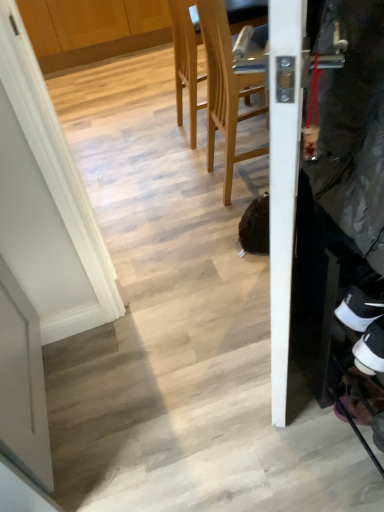
Question: Does white suede sneaker at lower right appear on the right side of wooden at center, acting as the first chair starting from the front?

Choices:
 (A) yes
 (B) no

Answer: (A)

Question: From the image's perspective, is white suede sneaker at lower right under wooden at center, acting as the first chair starting from the front?

Choices:
 (A) no
 (B) yes

Answer: (B)

Question: Considering the relative positions of white suede sneaker at lower right and wooden at center, acting as the first chair starting from the front, in the image provided, is white suede sneaker at lower right in front of wooden at center, acting as the first chair starting from the front,?

Choices:
 (A) yes
 (B) no

Answer: (A)

Question: Does white suede sneaker at lower right contain wooden at center, acting as the first chair starting from the front?

Choices:
 (A) yes
 (B) no

Answer: (B)

Question: Does white suede sneaker at lower right have a lesser width compared to wooden at center, acting as the first chair starting from the front?

Choices:
 (A) yes
 (B) no

Answer: (A)

Question: Does point (183, 16) appear closer or farther from the camera than point (259, 79)?

Choices:
 (A) closer
 (B) farther

Answer: (B)

Question: From the image's perspective, is light wood chair at upper center, which is the second chair from front to back, above or below wooden at center, the 2th chair when ordered from back to front?

Choices:
 (A) below
 (B) above

Answer: (B)

Question: Based on their positions, is light wood chair at upper center, which is the second chair from front to back, located to the left or right of wooden at center, acting as the first chair starting from the front?

Choices:
 (A) right
 (B) left

Answer: (B)

Question: In terms of size, does light wood chair at upper center, which is the second chair from front to back, appear bigger or smaller than wooden at center, the 2th chair when ordered from back to front?

Choices:
 (A) big
 (B) small

Answer: (A)

Question: Is point (193, 65) positioned closer to the camera than point (380, 354)?

Choices:
 (A) farther
 (B) closer

Answer: (A)

Question: Looking at their shapes, would you say light wood chair at upper center, marked as the 1th chair in a back-to-front arrangement, is wider or thinner than white suede sneaker at lower right?

Choices:
 (A) wide
 (B) thin

Answer: (A)

Question: Do you think light wood chair at upper center, which is the second chair from front to back, is within white suede sneaker at lower right, or outside of it?

Choices:
 (A) inside
 (B) outside

Answer: (B)

Question: Relative to white suede sneaker at lower right, is light wood chair at upper center, marked as the 1th chair in a back-to-front arrangement, in front or behind?

Choices:
 (A) behind
 (B) front

Answer: (A)

Question: Does point (266, 153) appear closer or farther from the camera than point (178, 87)?

Choices:
 (A) farther
 (B) closer

Answer: (B)

Question: Would you say wooden at center, the 2th chair when ordered from back to front, is to the left or to the right of light wood chair at upper center, which is the second chair from front to back, in the picture?

Choices:
 (A) left
 (B) right

Answer: (B)